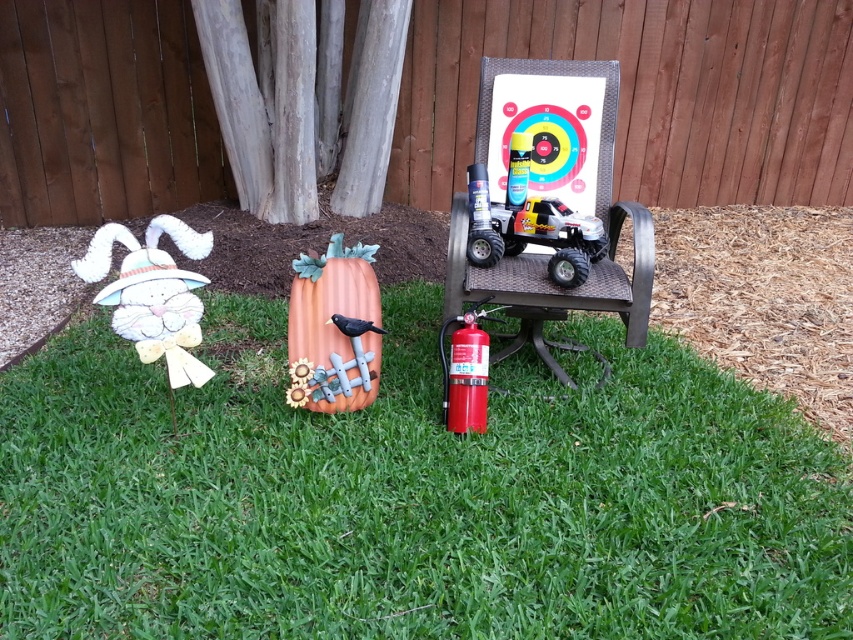
Question: Is green grass at lower center above white paper bunny at left?

Choices:
 (A) no
 (B) yes

Answer: (A)

Question: Which point appears farthest from the camera in this image?

Choices:
 (A) (648, 272)
 (B) (189, 355)
 (C) (505, 540)

Answer: (A)

Question: Is metallic red toy truck at center thinner than white paper bunny at left?

Choices:
 (A) yes
 (B) no

Answer: (B)

Question: Which object is the closest to the white paper bunny at left?

Choices:
 (A) green grass at lower center
 (B) matte pumpkin at center
 (C) metallic red toy truck at center

Answer: (B)

Question: Does green grass at lower center have a larger size compared to metallic red toy truck at center?

Choices:
 (A) yes
 (B) no

Answer: (A)

Question: Which of the following is the closest to the observer?

Choices:
 (A) green grass at lower center
 (B) metallic red toy truck at center
 (C) matte pumpkin at center
 (D) white paper bunny at left

Answer: (A)